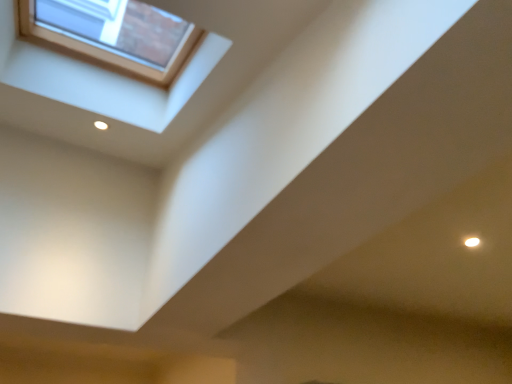
Find the location of a particular element. The height and width of the screenshot is (384, 512). clear glass window at upper left is located at coordinates (100, 79).

Measure the distance between point [59,93] and camera.

Point [59,93] and camera are 2.02 meters apart from each other.

Image resolution: width=512 pixels, height=384 pixels. What do you see at coordinates (100, 79) in the screenshot?
I see `clear glass window at upper left` at bounding box center [100, 79].

You are a GUI agent. You are given a task and a screenshot of the screen. Output one action in this format:
    pyautogui.click(x=<x>, y=<y>)
    Task: Click on the clear glass window at upper left
    The image size is (512, 384).
    Given the screenshot: What is the action you would take?
    pyautogui.click(x=100, y=79)